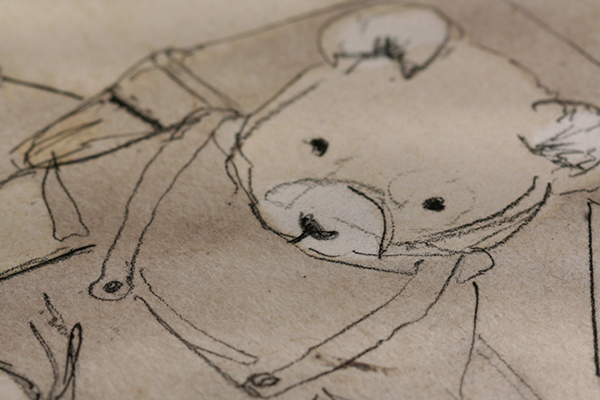
The image size is (600, 400). Identify the location of table. (150, 90).